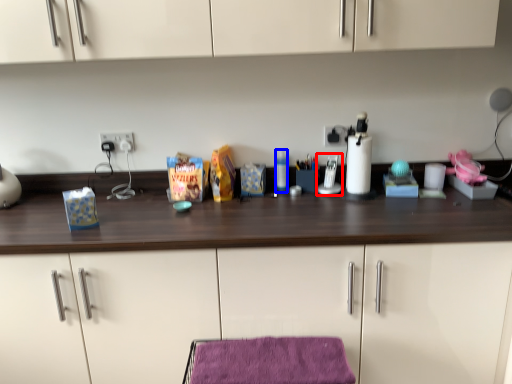
Question: Which object appears farthest to the camera in this image, appliance (highlighted by a red box) or bottle (highlighted by a blue box)?

Choices:
 (A) appliance
 (B) bottle

Answer: (B)